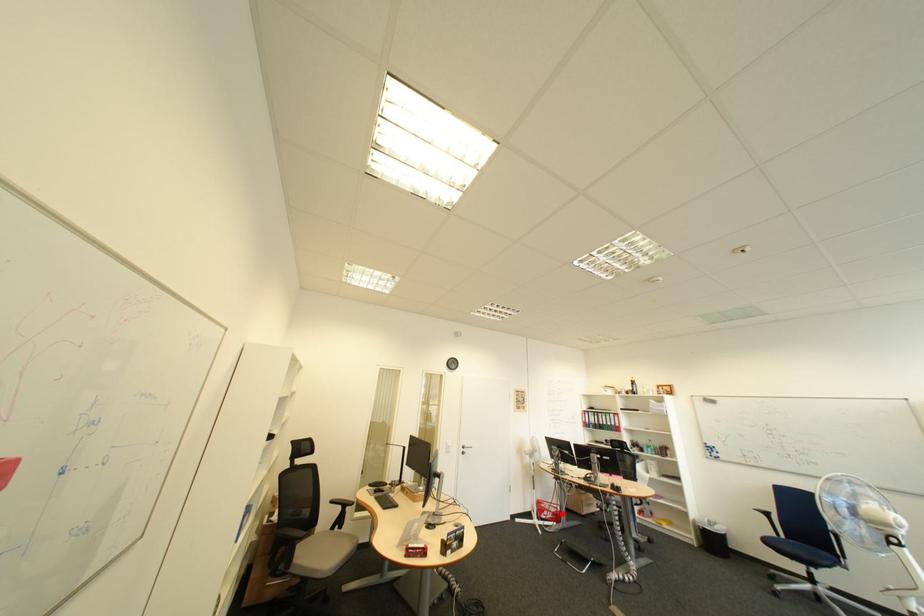
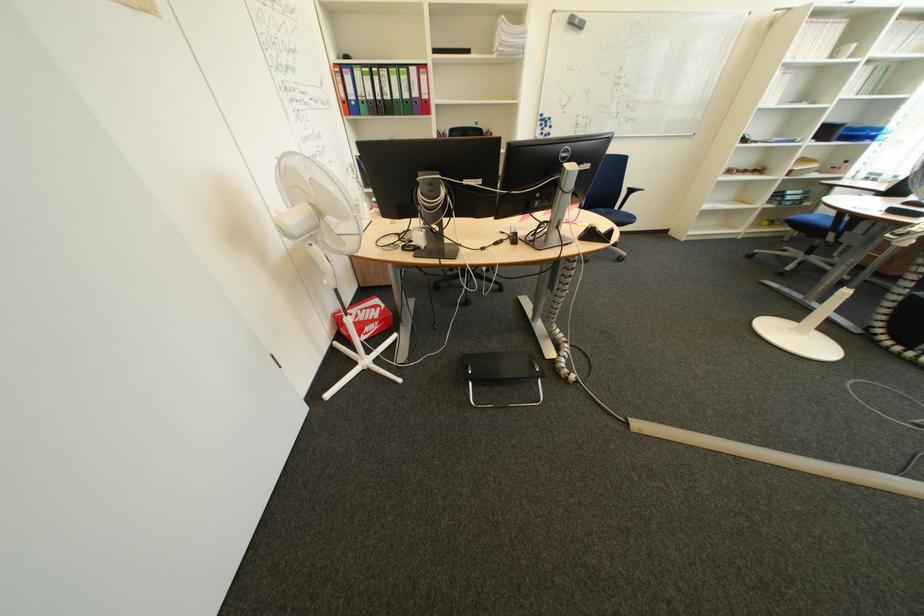
Where in the second image is the point corresponding to the highlighted location from the first image?

(385, 326)